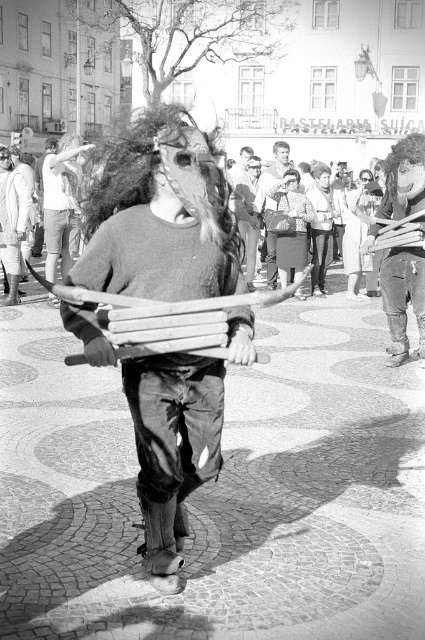
Question: Does fluffy dark brown hair at center have a smaller size compared to smooth leather jacket at center?

Choices:
 (A) no
 (B) yes

Answer: (B)

Question: Among these points, which one is nearest to the camera?

Choices:
 (A) (104, 236)
 (B) (102, 173)
 (C) (252, 221)

Answer: (A)

Question: Which object is farther from the camera taking this photo?

Choices:
 (A) smooth brown leather bag at center
 (B) wooden stick at center
 (C) fluffy dark brown hair at center

Answer: (A)

Question: Where is wooden stick at center located in relation to smooth brown leather bag at center in the image?

Choices:
 (A) below
 (B) above

Answer: (A)

Question: Is fluffy dark brown hair at center to the left of smooth brown leather bag at center from the viewer's perspective?

Choices:
 (A) yes
 (B) no

Answer: (A)

Question: Which object is the farthest from the wooden stick at center?

Choices:
 (A) smooth leather jacket at center
 (B) fluffy dark brown hair at center

Answer: (A)